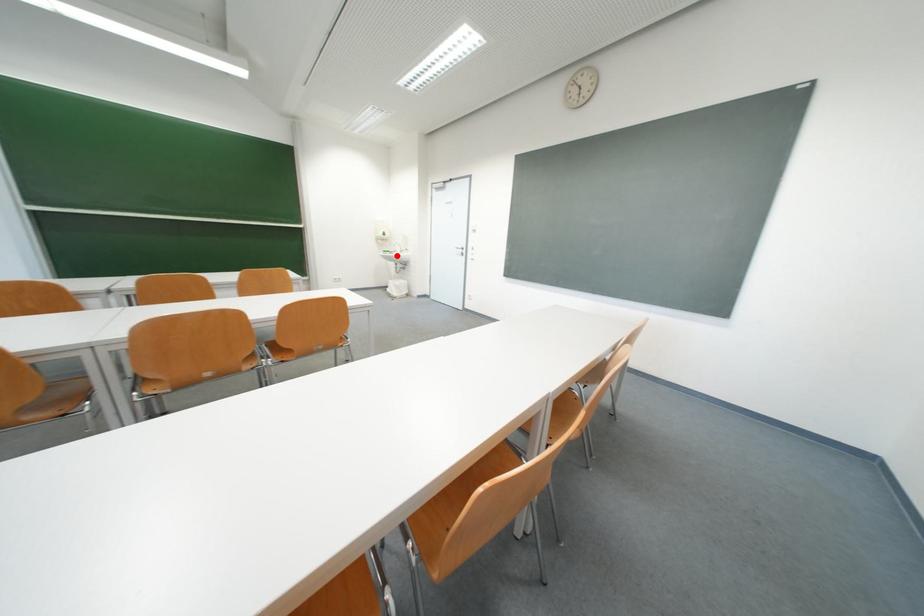
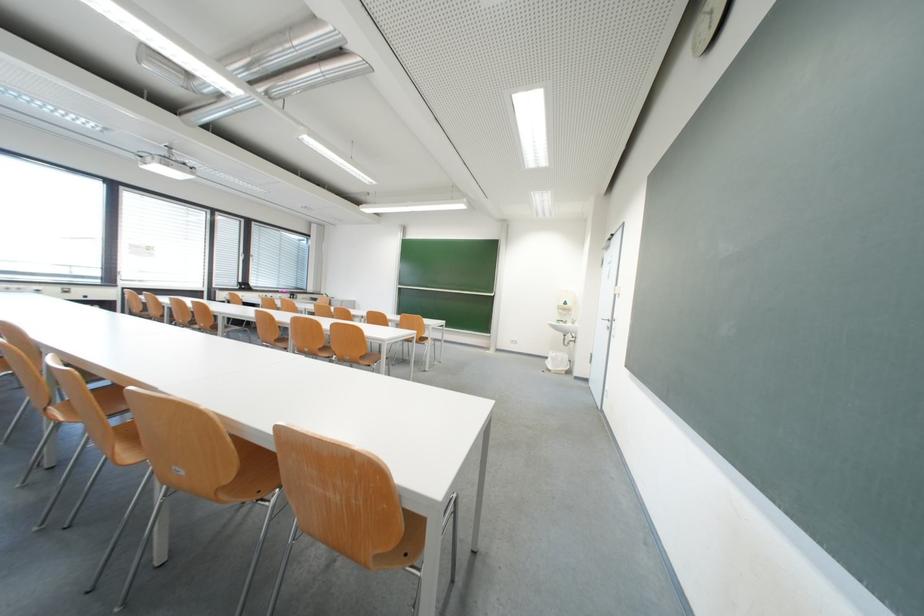
Question: A red point is marked in image1. In image2, is the corresponding 3D point closer to the camera or farther? Reply with the corresponding letter.

Choices:
 (A) The corresponding 3D point is closer.
 (B) The corresponding 3D point is farther.

Answer: (B)